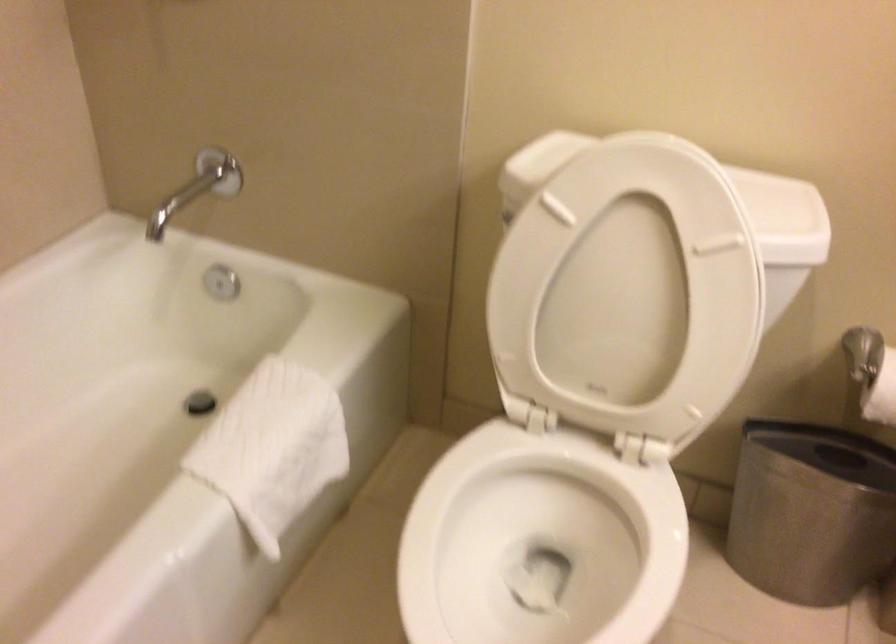
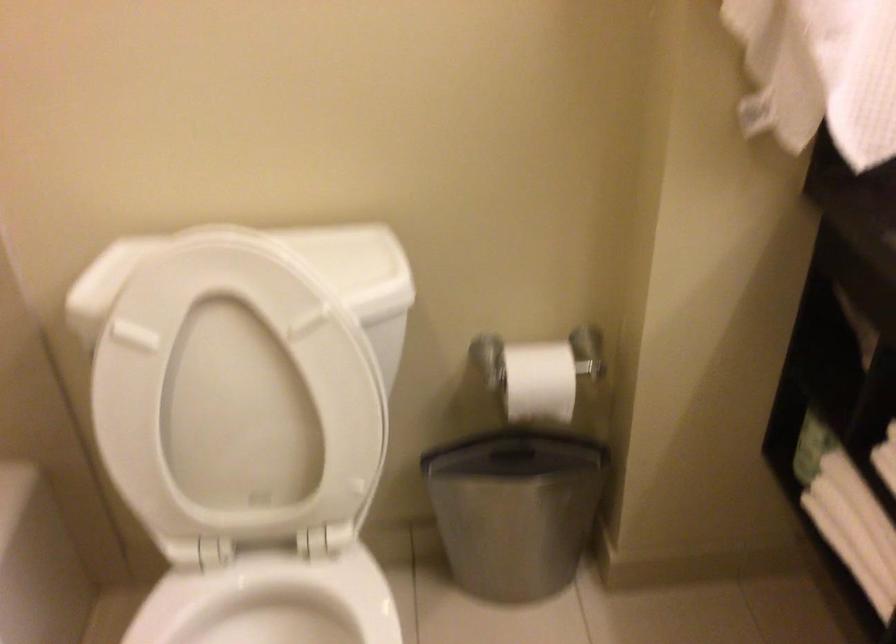
Question: The camera is either moving clockwise (left) or counter-clockwise (right) around the object. The first image is from the beginning of the video and the second image is from the end. Is the camera moving left or right when shooting the video?

Choices:
 (A) Left
 (B) Right

Answer: (A)